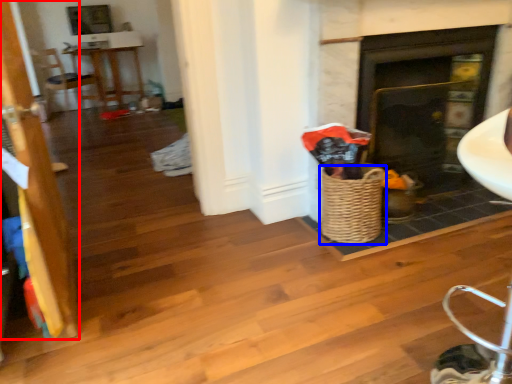
Question: Among these objects, which one is farthest to the camera, door (highlighted by a red box) or basket (highlighted by a blue box)?

Choices:
 (A) door
 (B) basket

Answer: (B)